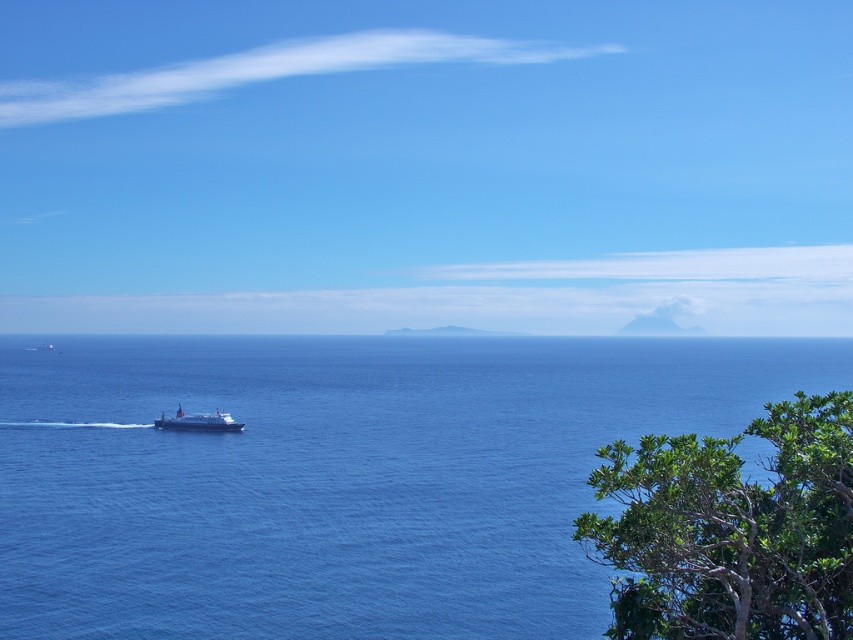
You are standing on the shore looking at the blue liquid water at center and the green leafy tree at lower right. Which object appears closer to you?

The blue liquid water at center appears closer because the green leafy tree at lower right is positioned behind it.

You are standing at the point marked as point (764,365) in the image. A seagull is flying 100 feet above the ocean surface. Can you see the seagull from your current position?

The distance between you and point (764,365) is 1173.34 feet. Since the seagull is only 100 feet above the ocean surface, it would be too low to be visible from that distance due to the curvature of the Earth and the horizon line blocking the view.

You are standing on the shore and looking out at the blue liquid water at center and the white glossy ferry at center. Which object appears higher in the image?

The blue liquid water at center appears higher than the white glossy ferry at center because it is taller.